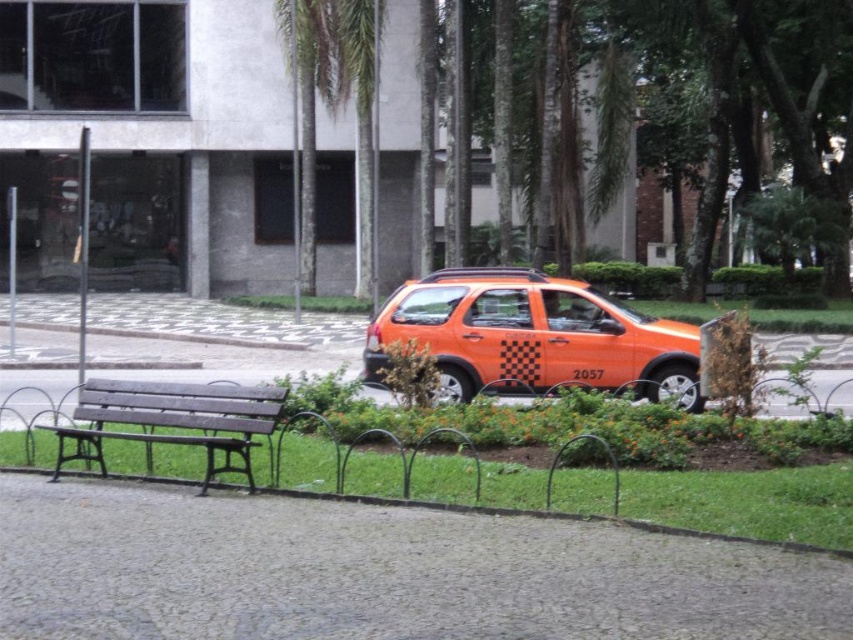
Question: Which of the following is the closest to the observer?

Choices:
 (A) (54, 428)
 (B) (113, 458)
 (C) (457, 324)

Answer: (A)

Question: Which object appears farthest from the camera in this image?

Choices:
 (A) wooden bench at center
 (B) orange matte car at center
 (C) orange matte taxi at center

Answer: (C)

Question: Does orange matte car at center lie behind orange matte taxi at center?

Choices:
 (A) no
 (B) yes

Answer: (A)

Question: Does orange matte taxi at center appear under wooden bench at center?

Choices:
 (A) no
 (B) yes

Answer: (A)

Question: Is orange matte car at center further to camera compared to orange matte taxi at center?

Choices:
 (A) yes
 (B) no

Answer: (B)

Question: Which object is positioned farthest from the wooden bench at center?

Choices:
 (A) orange matte taxi at center
 (B) orange matte car at center

Answer: (A)